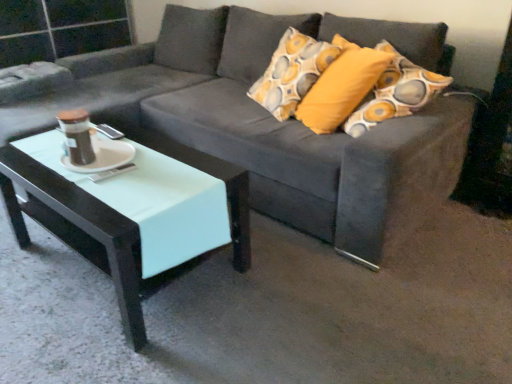
Question: Is white glossy saucer at center turned away from mint glossy coffee table at lower left?

Choices:
 (A) no
 (B) yes

Answer: (A)

Question: Is white glossy saucer at center closer to camera compared to mint glossy coffee table at lower left?

Choices:
 (A) no
 (B) yes

Answer: (A)

Question: From a real-world perspective, does white glossy saucer at center stand above mint glossy coffee table at lower left?

Choices:
 (A) no
 (B) yes

Answer: (B)

Question: From the image's perspective, is white glossy saucer at center under mint glossy coffee table at lower left?

Choices:
 (A) no
 (B) yes

Answer: (A)

Question: Is white glossy saucer at center oriented towards mint glossy coffee table at lower left?

Choices:
 (A) no
 (B) yes

Answer: (A)

Question: Considering the relative sizes of white glossy saucer at center and mint glossy coffee table at lower left in the image provided, is white glossy saucer at center smaller than mint glossy coffee table at lower left?

Choices:
 (A) no
 (B) yes

Answer: (B)

Question: From a real-world perspective, is mint glossy coffee table at lower left physically below white glossy saucer at center?

Choices:
 (A) no
 (B) yes

Answer: (B)

Question: Is white glossy saucer at center inside mint glossy coffee table at lower left?

Choices:
 (A) yes
 (B) no

Answer: (B)

Question: Are mint glossy coffee table at lower left and white glossy saucer at center beside each other?

Choices:
 (A) no
 (B) yes

Answer: (A)

Question: From the image's perspective, is mint glossy coffee table at lower left under white glossy saucer at center?

Choices:
 (A) no
 (B) yes

Answer: (B)

Question: From the image's perspective, would you say mint glossy coffee table at lower left is positioned over white glossy saucer at center?

Choices:
 (A) no
 (B) yes

Answer: (A)

Question: Does mint glossy coffee table at lower left have a greater width compared to white glossy saucer at center?

Choices:
 (A) no
 (B) yes

Answer: (B)

Question: Considering the relative sizes of mint glossy coffee table at lower left and suede gray couch at center in the image provided, is mint glossy coffee table at lower left thinner than suede gray couch at center?

Choices:
 (A) yes
 (B) no

Answer: (A)